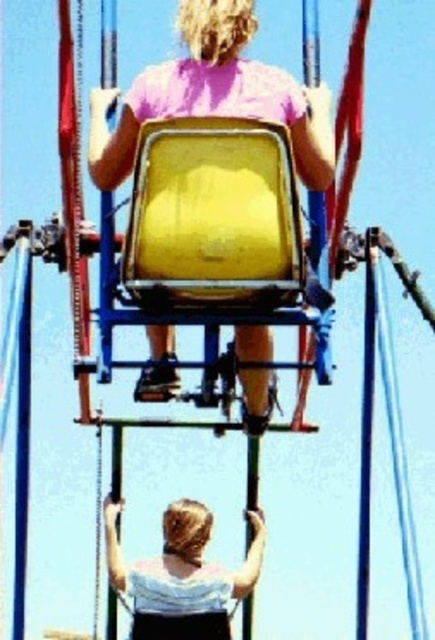
Question: Can you confirm if yellow matte seat at center is thinner than white matte shirt at lower center?

Choices:
 (A) no
 (B) yes

Answer: (A)

Question: In this image, where is yellow matte seat at center located relative to white matte shirt at lower center?

Choices:
 (A) left
 (B) right

Answer: (A)

Question: Which point appears farthest from the camera in this image?

Choices:
 (A) (180, 67)
 (B) (130, 589)

Answer: (B)

Question: Is yellow matte seat at center below white matte shirt at lower center?

Choices:
 (A) no
 (B) yes

Answer: (A)